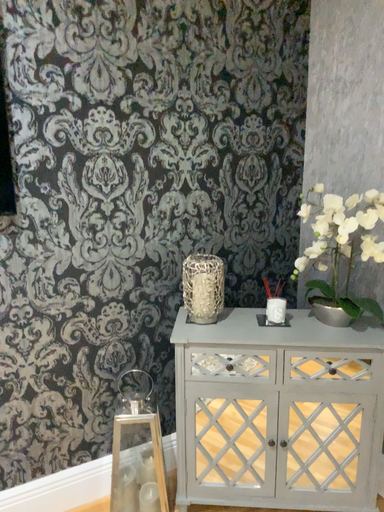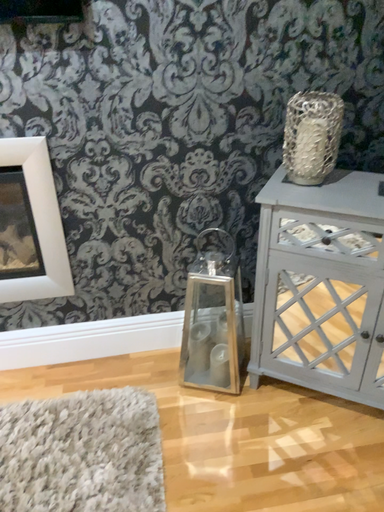
Question: Which way did the camera rotate in the video?

Choices:
 (A) rotated upward
 (B) rotated downward

Answer: (B)